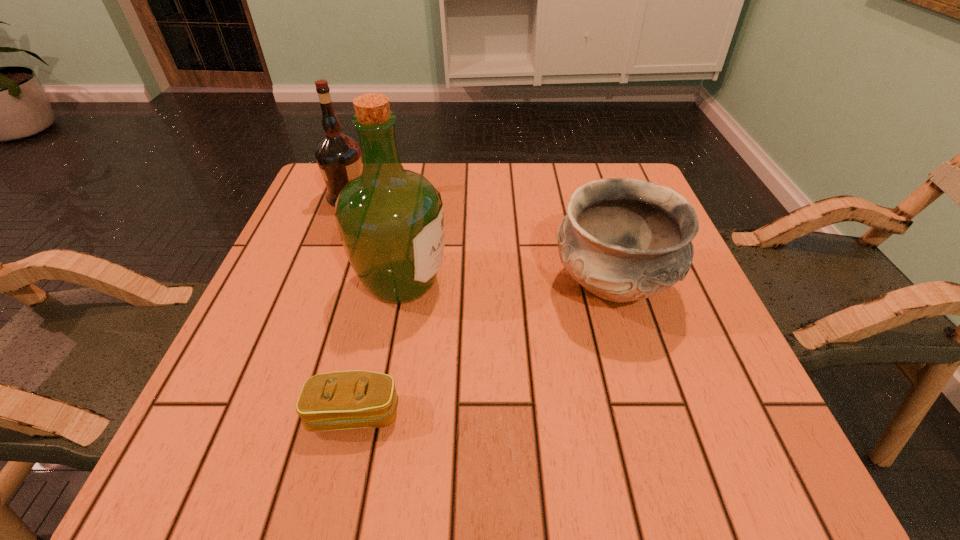
In the image, there is a desktop. Identify the location of free space at the far right corner. (586, 180).

In the image, there is a desktop. In order to click on blank space at the near right corner in this screenshot , I will do `click(676, 481)`.

The image size is (960, 540). In order to click on free spot between the second tallest object and the clutch bag in this screenshot , I will do [351, 305].

You are a GUI agent. You are given a task and a screenshot of the screen. Output one action in this format:
    pyautogui.click(x=<x>, y=<y>)
    Task: Click on the free area in between the tallest object and the pottery
    Image resolution: width=960 pixels, height=540 pixels.
    Given the screenshot: What is the action you would take?
    pyautogui.click(x=507, y=284)

Where is `free area in between the clutch bag and the taller liquor`? The width and height of the screenshot is (960, 540). free area in between the clutch bag and the taller liquor is located at coordinates (378, 348).

Where is `free space between the rightmost object and the left liquor`? The height and width of the screenshot is (540, 960). free space between the rightmost object and the left liquor is located at coordinates (480, 241).

Identify the location of free space between the rightmost object and the leftmost object. Image resolution: width=960 pixels, height=540 pixels. (480, 241).

This screenshot has width=960, height=540. I want to click on vacant area that lies between the farther liquor and the rightmost object, so click(x=480, y=241).

This screenshot has height=540, width=960. I want to click on vacant point located between the nearest object and the taller liquor, so click(378, 348).

Locate an element on the screen. empty space between the rightmost object and the clutch bag is located at coordinates (483, 349).